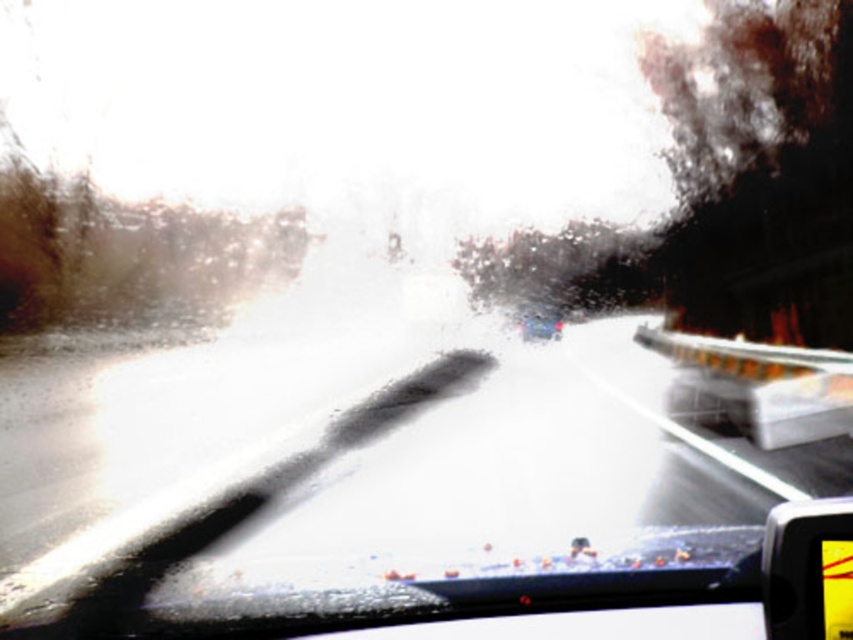
You are a passenger in the metallic silver car at center. You want to check the traffic behind you using the yellow plastic view mirror at lower right. Can you see the traffic behind you through this mirror?

The yellow plastic view mirror at lower right is located below the metallic silver car at center, so the car may block your view of the traffic behind you through the mirror.

You are a passenger in the car and want to check the yellow plastic view mirror at lower right. Where should you look to find it?

The yellow plastic view mirror at lower right is located at point (808, 570), which is near the bottom right corner of the windshield.